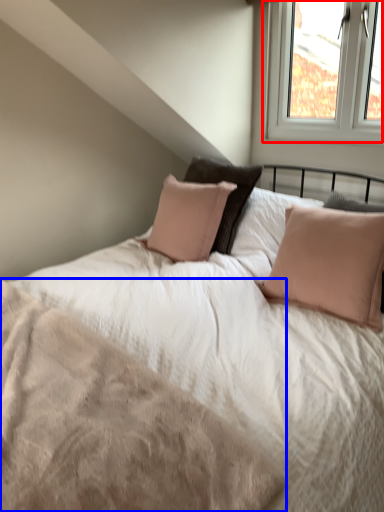
Question: Which object is further to the camera taking this photo, window (highlighted by a red box) or mattress (highlighted by a blue box)?

Choices:
 (A) window
 (B) mattress

Answer: (A)